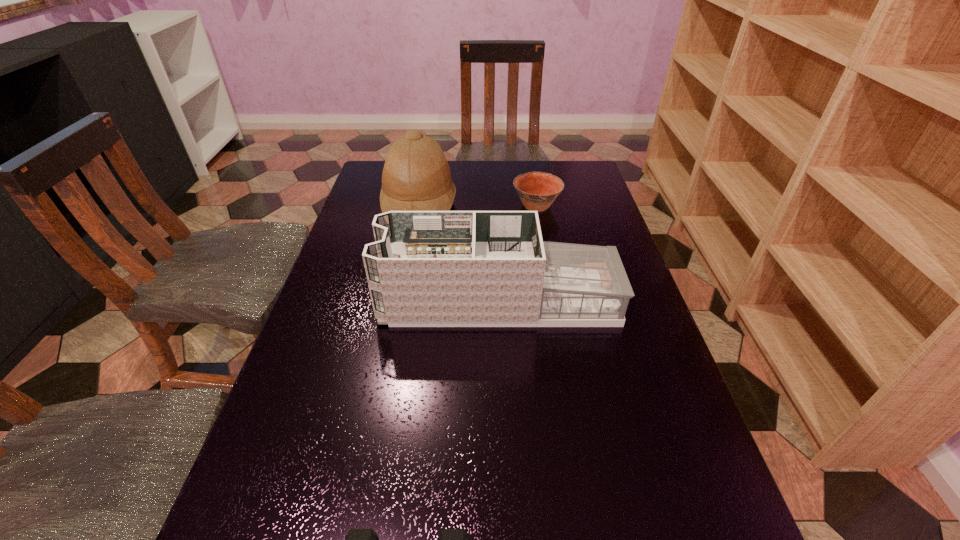
At what (x,y) coordinates should I click in order to perform the action: click on the tallest object. Please return your answer as a coordinate pair (x, y). The width and height of the screenshot is (960, 540). Looking at the image, I should click on (416, 176).

The image size is (960, 540). I want to click on the second nearest object, so click(426, 268).

The width and height of the screenshot is (960, 540). What are the coordinates of `dollhouse` in the screenshot? It's located at (426, 268).

The image size is (960, 540). What are the coordinates of `the second shortest object` in the screenshot? It's located at (537, 190).

I want to click on free location located 0.050m on the front-facing side of the tallest object, so click(472, 206).

The width and height of the screenshot is (960, 540). What are the coordinates of `free space located at the entrance of the dollhouse` in the screenshot? It's located at (335, 300).

At what (x,y) coordinates should I click in order to perform the action: click on free location located 0.050m at the entrance of the dollhouse. Please return your answer as a coordinate pair (x, y). Looking at the image, I should click on pyautogui.click(x=361, y=300).

Locate an element on the screen. The width and height of the screenshot is (960, 540). vacant point located 0.120m at the entrance of the dollhouse is located at coordinates (331, 300).

Find the location of a particular element. The height and width of the screenshot is (540, 960). vacant area situated 0.060m on the front of the bowl is located at coordinates (541, 231).

The width and height of the screenshot is (960, 540). Find the location of `hat that is at the far edge`. hat that is at the far edge is located at coordinates (416, 176).